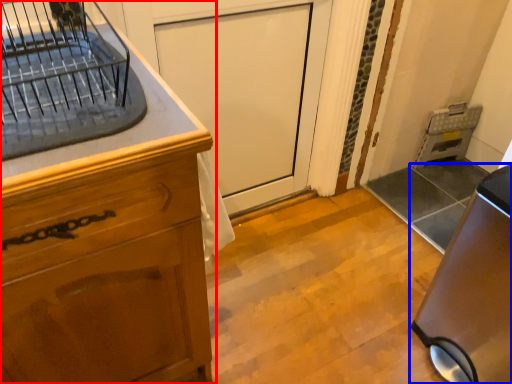
Question: Which object is further to the camera taking this photo, cabinetry (highlighted by a red box) or home appliance (highlighted by a blue box)?

Choices:
 (A) cabinetry
 (B) home appliance

Answer: (B)